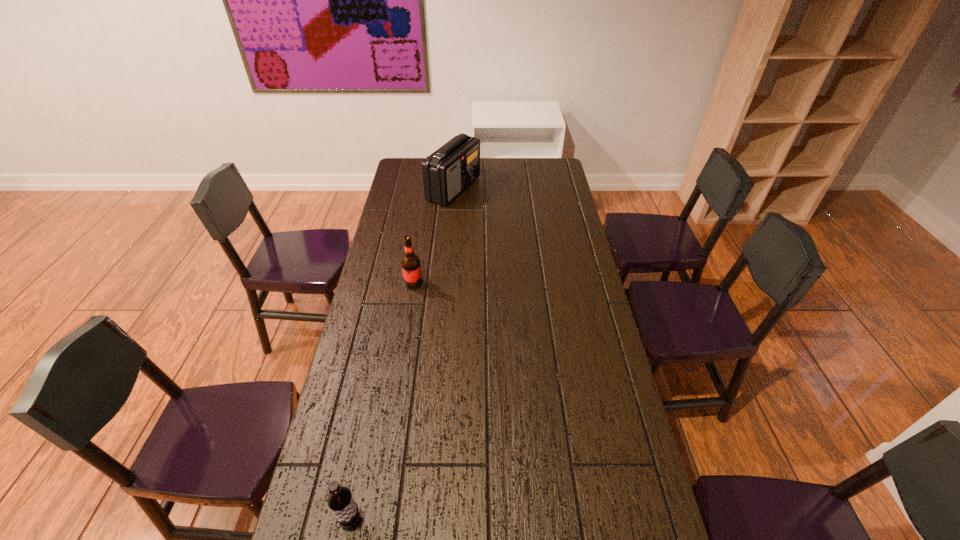
At what (x,y) coordinates should I click in order to perform the action: click on radio receiver. Please return your answer as a coordinate pair (x, y). The width and height of the screenshot is (960, 540). Looking at the image, I should click on (451, 169).

This screenshot has width=960, height=540. What are the coordinates of `the farther root beer` in the screenshot? It's located at (411, 267).

Where is `the right root beer`? the right root beer is located at coordinates (411, 267).

Locate an element on the screen. This screenshot has width=960, height=540. the nearest object is located at coordinates (340, 500).

This screenshot has height=540, width=960. Identify the location of the leftmost object. (340, 500).

Locate an element on the screen. This screenshot has height=540, width=960. vacant space situated on the front panel of the radio receiver is located at coordinates (553, 188).

Image resolution: width=960 pixels, height=540 pixels. I want to click on free space located 0.310m on the right of the farther root beer, so click(x=504, y=284).

At what (x,y) coordinates should I click in order to perform the action: click on vacant area located 0.290m on the right of the shortest object. Please return your answer as a coordinate pair (x, y). The height and width of the screenshot is (540, 960). Looking at the image, I should click on (481, 519).

The width and height of the screenshot is (960, 540). In order to click on object present at the far edge in this screenshot , I will do `click(451, 169)`.

In order to click on free space at the far edge in this screenshot , I will do `click(520, 179)`.